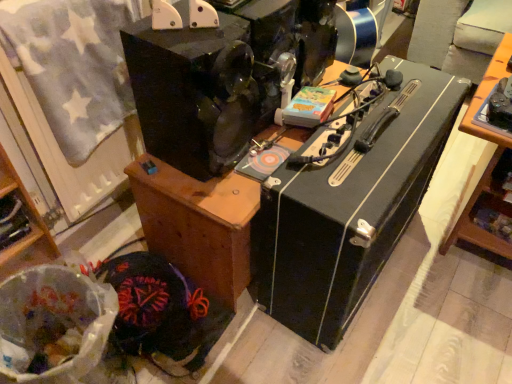
Question: Is wooden cabinet at lower left, placed as the first furniture when sorted from left to right, at the left side of black matte speaker at center, the 1th furniture from the right?

Choices:
 (A) no
 (B) yes

Answer: (B)

Question: Is wooden cabinet at lower left, placed as the first furniture when sorted from left to right, directly adjacent to black matte speaker at center, which is the 2th furniture in left-to-right order?

Choices:
 (A) no
 (B) yes

Answer: (A)

Question: Can you confirm if wooden cabinet at lower left, placed as the first furniture when sorted from left to right, is smaller than black matte speaker at center, the 1th furniture from the right?

Choices:
 (A) no
 (B) yes

Answer: (B)

Question: From the image's perspective, is wooden cabinet at lower left, placed as the first furniture when sorted from left to right, located above black matte speaker at center, which is the 2th furniture in left-to-right order?

Choices:
 (A) no
 (B) yes

Answer: (A)

Question: Is wooden cabinet at lower left, placed as the first furniture when sorted from left to right, oriented away from black matte speaker at center, which is the 2th furniture in left-to-right order?

Choices:
 (A) no
 (B) yes

Answer: (A)

Question: Can you confirm if wooden cabinet at lower left, marked as the second furniture in a right-to-left arrangement, is bigger than black matte speaker at center, which is the 2th furniture in left-to-right order?

Choices:
 (A) yes
 (B) no

Answer: (B)

Question: Is the depth of black hard case at center greater than that of velvet-like fabric at lower left, the second waste viewed from the front?

Choices:
 (A) no
 (B) yes

Answer: (A)

Question: From the image's perspective, is black hard case at center below velvet-like fabric at lower left, which is the first waste in back-to-front order?

Choices:
 (A) no
 (B) yes

Answer: (A)

Question: Is the position of black hard case at center less distant than that of velvet-like fabric at lower left, the second waste viewed from the front?

Choices:
 (A) yes
 (B) no

Answer: (A)

Question: Is black hard case at center at the right side of velvet-like fabric at lower left, which is the first waste in back-to-front order?

Choices:
 (A) no
 (B) yes

Answer: (B)

Question: From the image's perspective, is black hard case at center located above velvet-like fabric at lower left, the second waste viewed from the front?

Choices:
 (A) yes
 (B) no

Answer: (A)

Question: Can you see black hard case at center touching velvet-like fabric at lower left, the second waste viewed from the front?

Choices:
 (A) no
 (B) yes

Answer: (A)

Question: Does black matte speaker at center, the 1th furniture from the right, appear on the left side of wooden cabinet at lower left, placed as the first furniture when sorted from left to right?

Choices:
 (A) yes
 (B) no

Answer: (B)